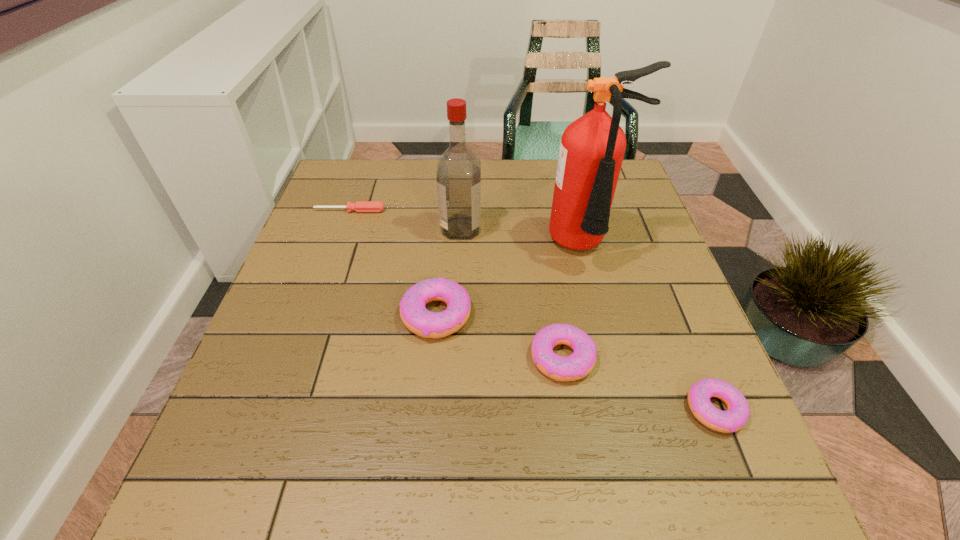
Locate an element on the screen. Image resolution: width=960 pixels, height=540 pixels. the tallest doughnut is located at coordinates 413,312.

Locate an element on the screen. The image size is (960, 540). the fourth shortest object is located at coordinates (413, 312).

Identify the location of the second tallest doughnut. The image size is (960, 540). (578, 365).

This screenshot has width=960, height=540. I want to click on the third shortest object, so click(x=578, y=365).

The image size is (960, 540). In order to click on the second shortest object in this screenshot , I will do `click(737, 414)`.

Image resolution: width=960 pixels, height=540 pixels. Identify the location of the shortest doughnut. (737, 414).

Find the location of `the tallest object`. the tallest object is located at coordinates pyautogui.click(x=592, y=148).

Locate an element on the screen. The width and height of the screenshot is (960, 540). liquor is located at coordinates (458, 176).

What are the coordinates of `screwdriver` in the screenshot? It's located at (360, 206).

The height and width of the screenshot is (540, 960). What are the coordinates of `the shortest object` in the screenshot? It's located at (360, 206).